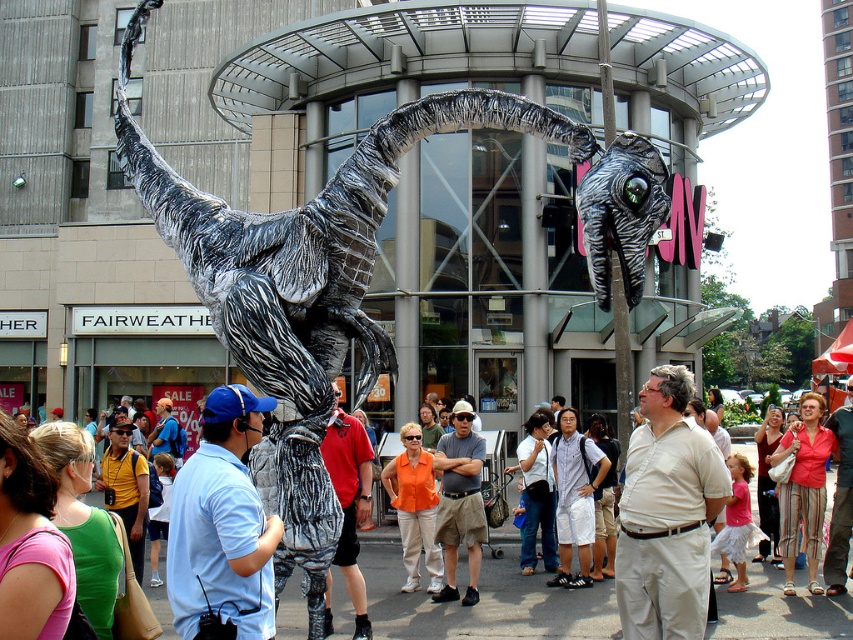
You are a city planner assessing the urban sculpture placements. The silver metallic dinosaur at center and the shiny metallic alien at center are both positioned on poles. Which sculpture would require a taller pole to accommodate its height?

The silver metallic dinosaur at center requires a taller pole because it has a greater height compared to the shiny metallic alien at center.

You are a city planner reviewing the layout of the urban street scene. The dinosaur sculpture must be relocated to a new position at point 0.5, 0.5. What is the direction you need to move the silver metallic dinosaur at center to reach the new coordinates?

Result: To move the silver metallic dinosaur at center from its current position at point (306, 284) to the new coordinates (426, 320), you would need to move it northeast. This adjustment ensures the dinosaur is positioned at the desired central point in the urban street scene.